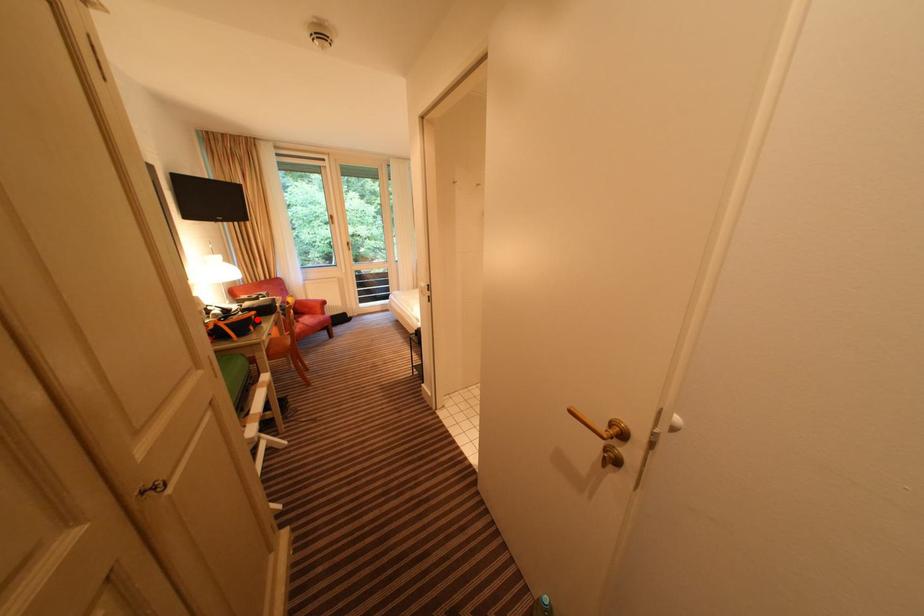
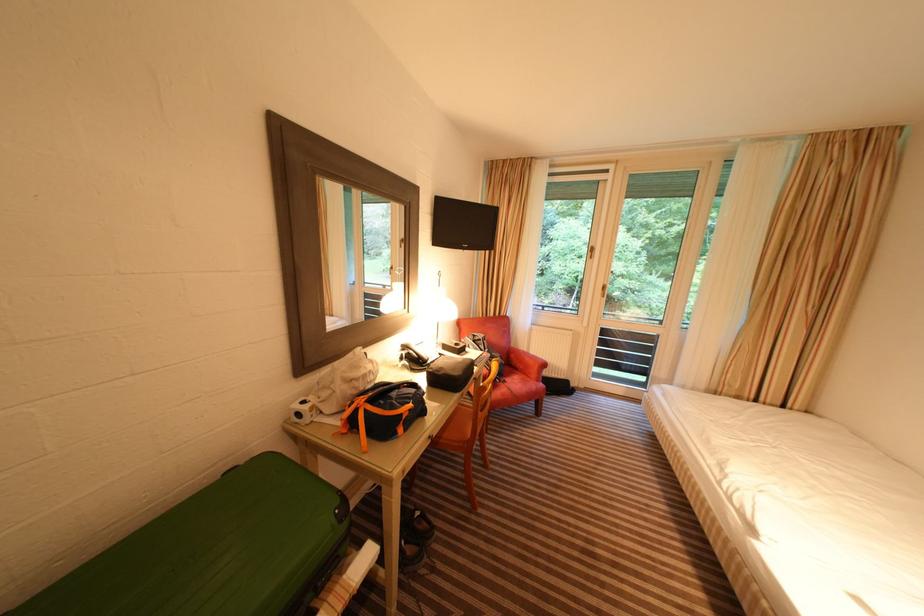
Where in the second image is the point corresponding to the highlighted location from the first image?

(407, 416)